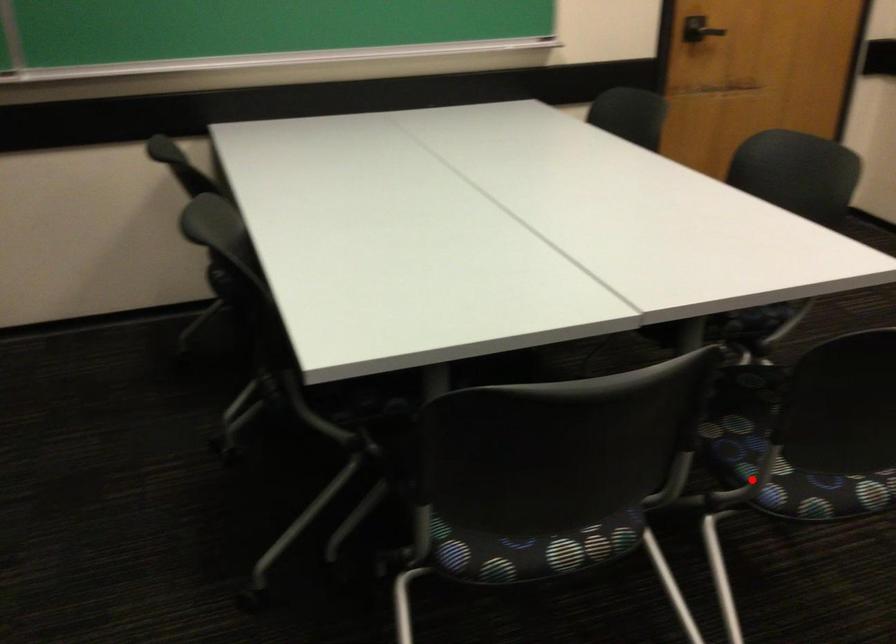
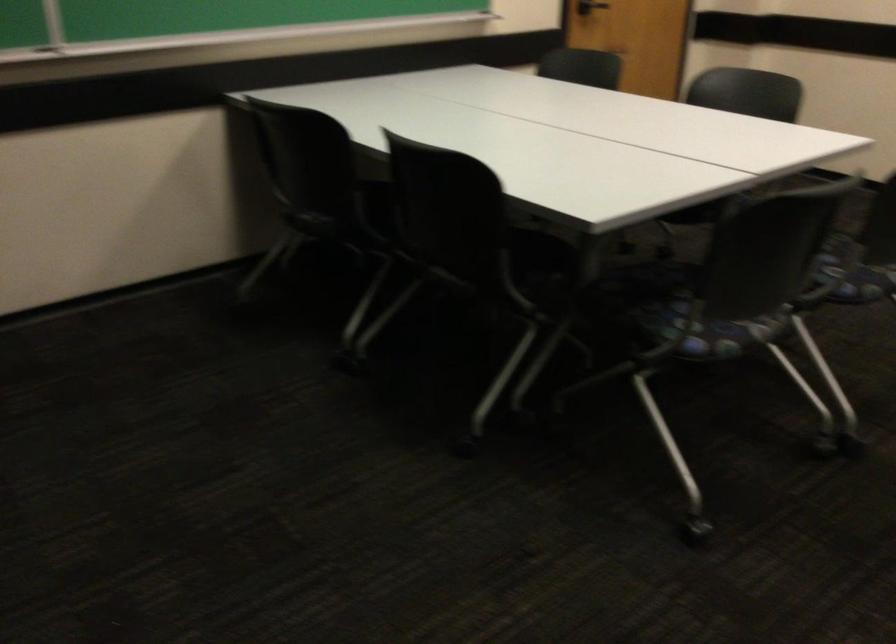
Question: A red point is marked in image1. In image2, is the corresponding 3D point closer to the camera or farther? Reply with the corresponding letter.

Choices:
 (A) The corresponding 3D point is closer.
 (B) The corresponding 3D point is farther.

Answer: (B)